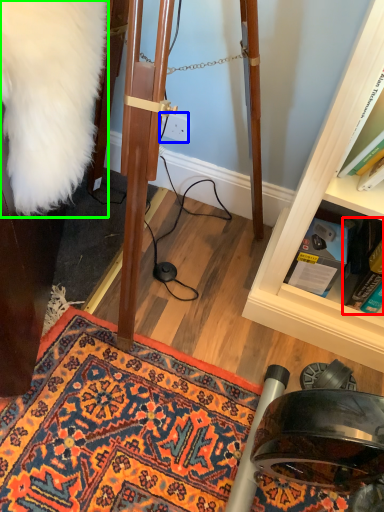
Question: Based on their relative distances, which object is farther from book (highlighted by a red box)? Choose from power outlet (highlighted by a blue box) and fur coat (highlighted by a green box).

Choices:
 (A) power outlet
 (B) fur coat

Answer: (B)